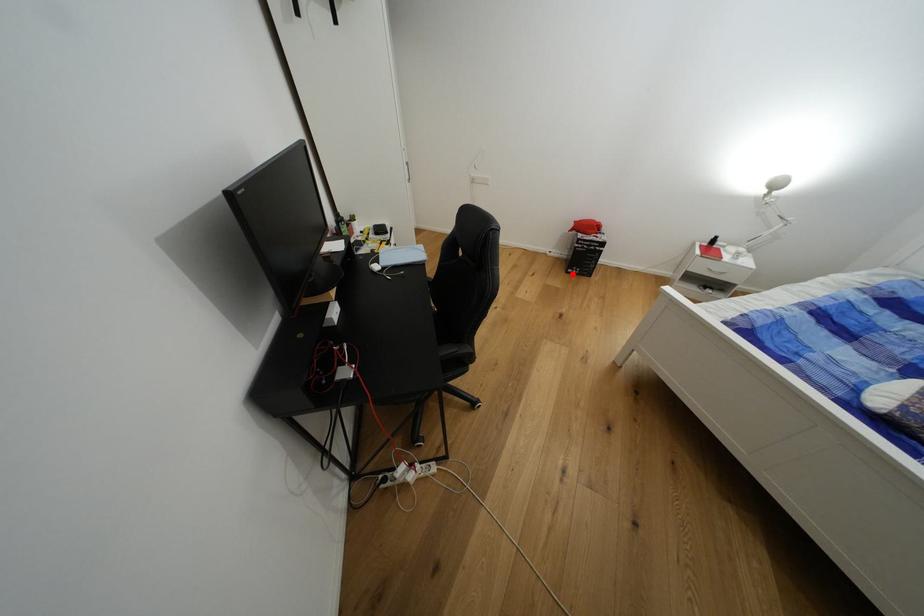
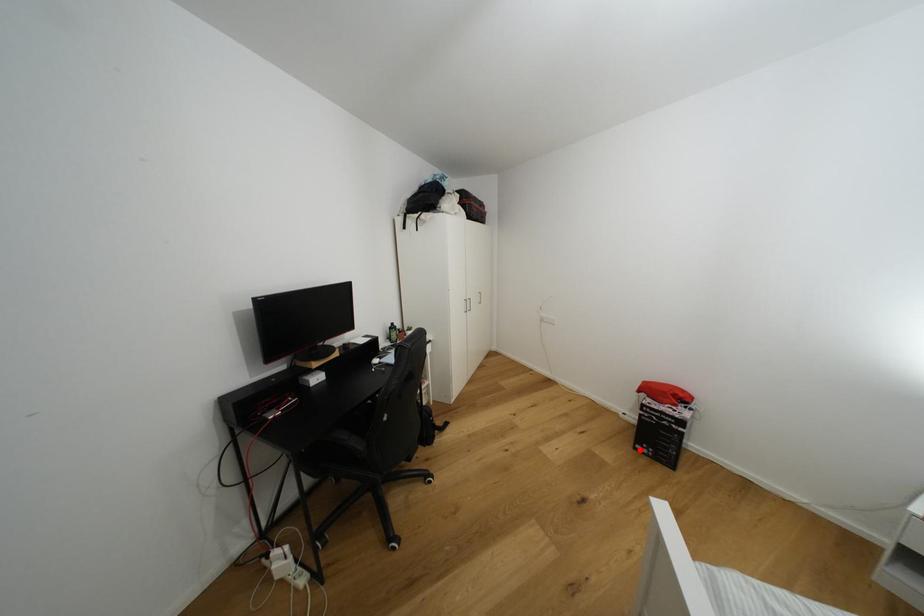
I am providing you with two images of the same scene from different viewpoints. A red point is marked on the first image and another point is marked on the second image. Does the point marked in image1 correspond to the same location as the one in image2?

Yes